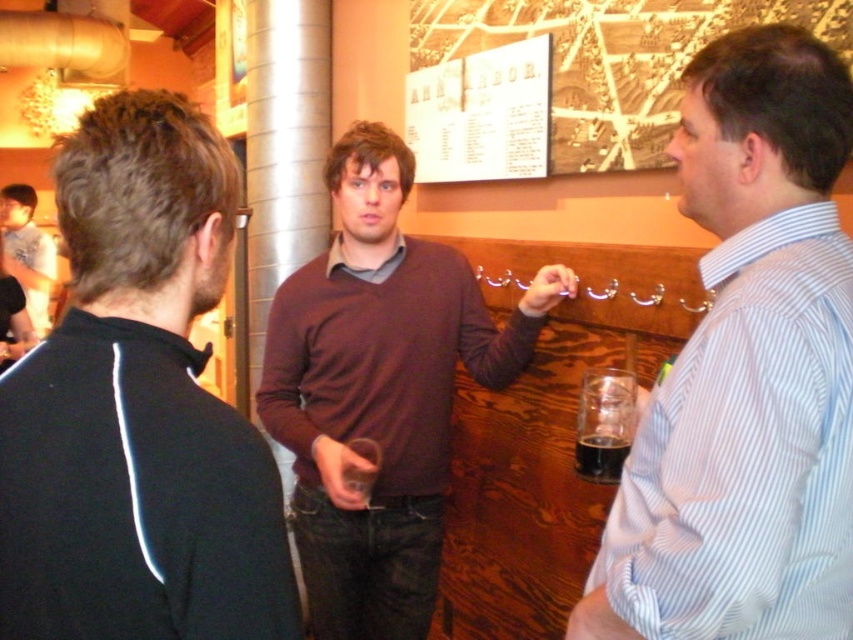
Can you confirm if black matte jacket at left is wider than dark glassy beverage at lower right?

Yes.

Who is taller, black matte jacket at left or dark glassy beverage at lower right?

With more height is black matte jacket at left.

Does point (24, 422) come closer to viewer compared to point (577, 451)?

Yes, point (24, 422) is closer to viewer.

At what (x,y) coordinates should I click in order to perform the action: click on black matte jacket at left. Please return your answer as a coordinate pair (x, y). Looking at the image, I should click on (138, 408).

Can you confirm if maroon sweater at center is shorter than matte black shirt at left?

No.

Consider the image. Is maroon sweater at center taller than matte black shirt at left?

Indeed, maroon sweater at center has a greater height compared to matte black shirt at left.

Who is more forward, [335,284] or [16,259]?

Point [335,284] is in front.

What are the coordinates of `maroon sweater at center` in the screenshot? It's located at (379, 390).

Between point (582, 401) and point (54, 250), which one is positioned behind?

The point (54, 250) is more distant.

Measure the distance between transparent glass at center and matte black shirt at left.

They are 4.07 meters apart.

Measure the distance between transparent glass at center and camera.

transparent glass at center is 1.49 meters away from camera.

The height and width of the screenshot is (640, 853). In order to click on transparent glass at center in this screenshot , I will do `click(604, 422)`.